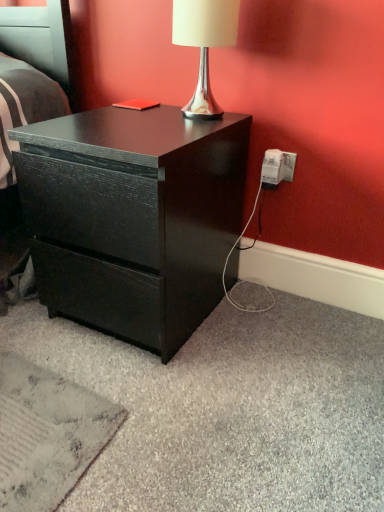
Identify the location of free spot in front of matte black drawer at center. (145, 408).